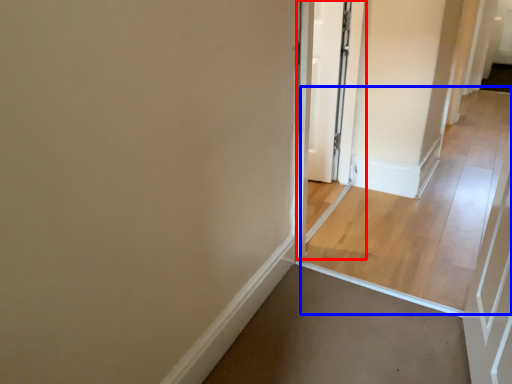
Question: Which object appears closest to the camera in this image, screen door (highlighted by a red box) or path (highlighted by a blue box)?

Choices:
 (A) screen door
 (B) path

Answer: (A)